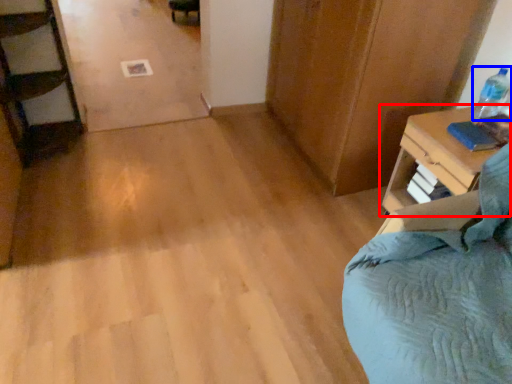
Question: Which object is closer to the camera taking this photo, nightstand (highlighted by a red box) or bottle (highlighted by a blue box)?

Choices:
 (A) nightstand
 (B) bottle

Answer: (A)